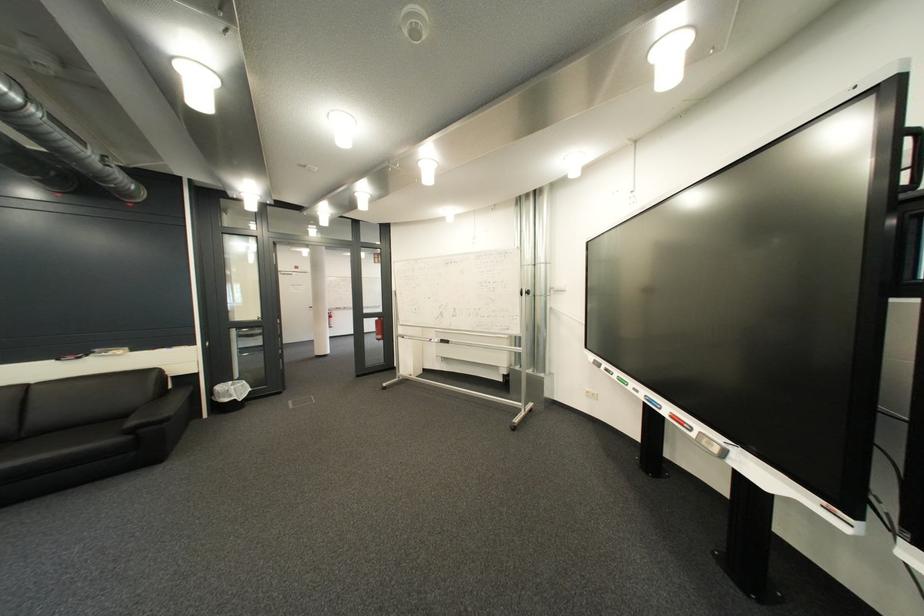
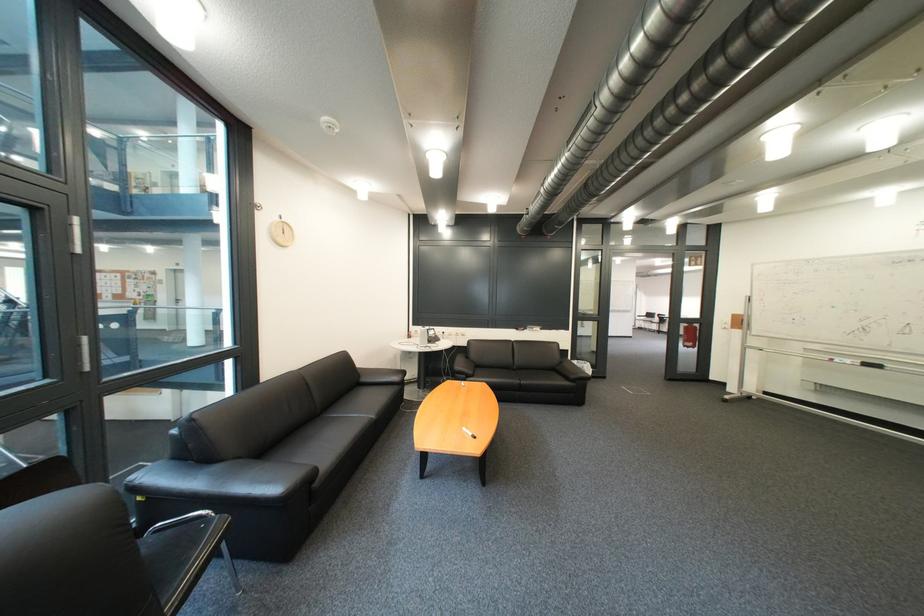
The point at (294, 394) is marked in the first image. Where is the corresponding point in the second image?

(618, 379)